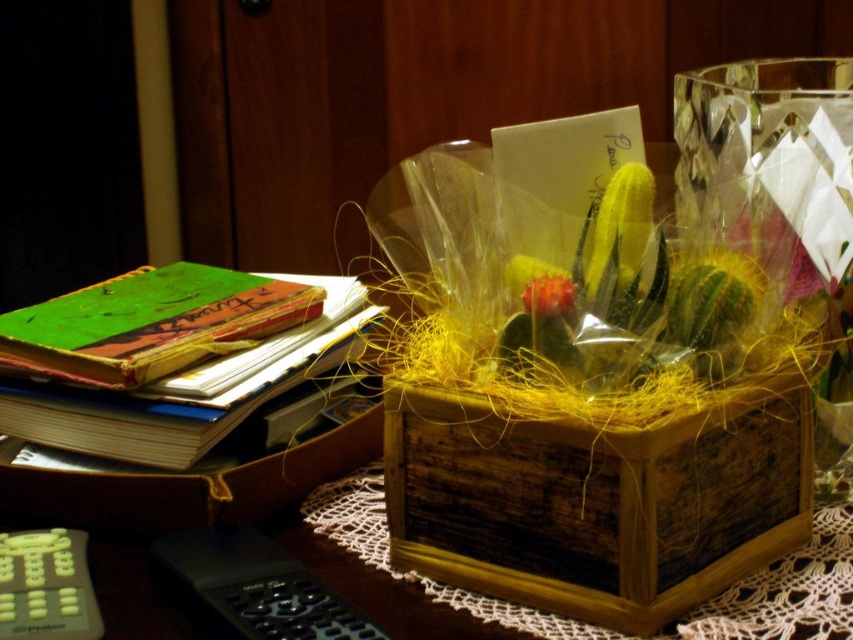
You are a florist arranging flowers in the wooden box at center. You have a fluffy orange flower at center that you want to place inside. Can you fit it in the box?

The wooden box at center is larger in size than the fluffy orange flower at center, so yes, the flower can fit inside the box.

You are organizing a small party and need to place a centerpiece on a table. You have the wooden box at center and the transparent glass vase at center. Which one should you choose if you want the widest option available?

The wooden box at center is wider than the transparent glass vase at center, so you should choose the wooden box at center for the widest option.